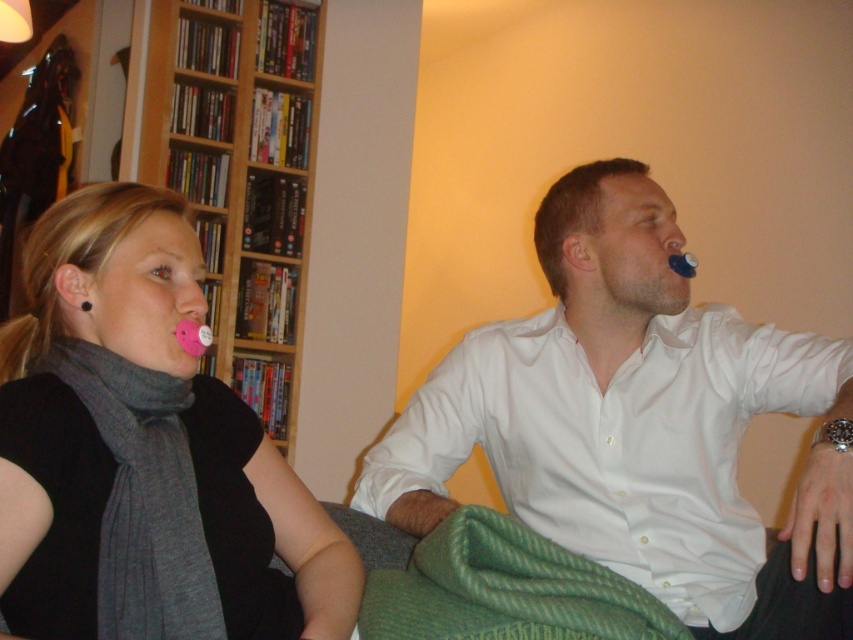
Question: Does white smooth shirt at upper right lie in front of wooden bookshelf at upper left?

Choices:
 (A) no
 (B) yes

Answer: (B)

Question: Which point is farther to the camera?

Choices:
 (A) wooden bookshelf at upper left
 (B) white smooth shirt at upper right

Answer: (A)

Question: Does matte pink pacifier at left appear under wooden bookshelf at upper left?

Choices:
 (A) yes
 (B) no

Answer: (A)

Question: Which object is farther from the camera taking this photo?

Choices:
 (A) gray wool scarf at left
 (B) white smooth shirt at upper right

Answer: (A)

Question: Does white smooth shirt at upper right come behind matte pink pacifier at left?

Choices:
 (A) no
 (B) yes

Answer: (B)

Question: Among these points, which one is nearest to the camera?

Choices:
 (A) (152, 243)
 (B) (428, 509)
 (C) (297, 364)

Answer: (A)